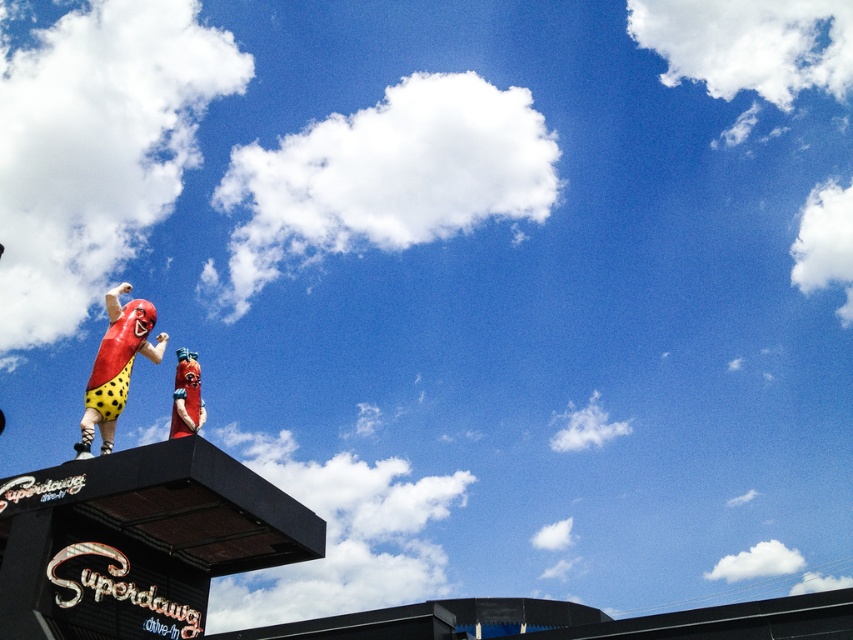
Who is more forward, (82, 440) or (190, 388)?

Point (82, 440)

Is point (120, 392) positioned behind point (196, 406)?

Yes, point (120, 392) is behind point (196, 406).

Find the location of a particular element. The height and width of the screenshot is (640, 853). glossy plastic hot dog at upper left is located at coordinates (115, 365).